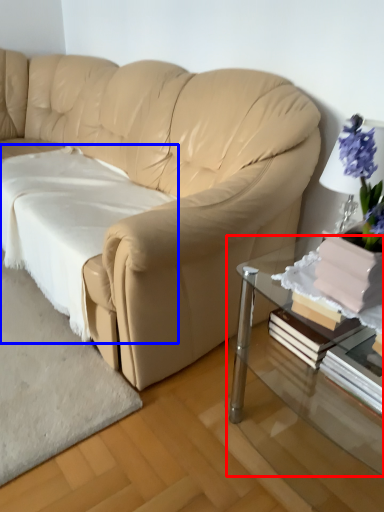
Question: Which point is closer to the camera, table (highlighted by a red box) or sheet (highlighted by a blue box)?

Choices:
 (A) table
 (B) sheet

Answer: (A)